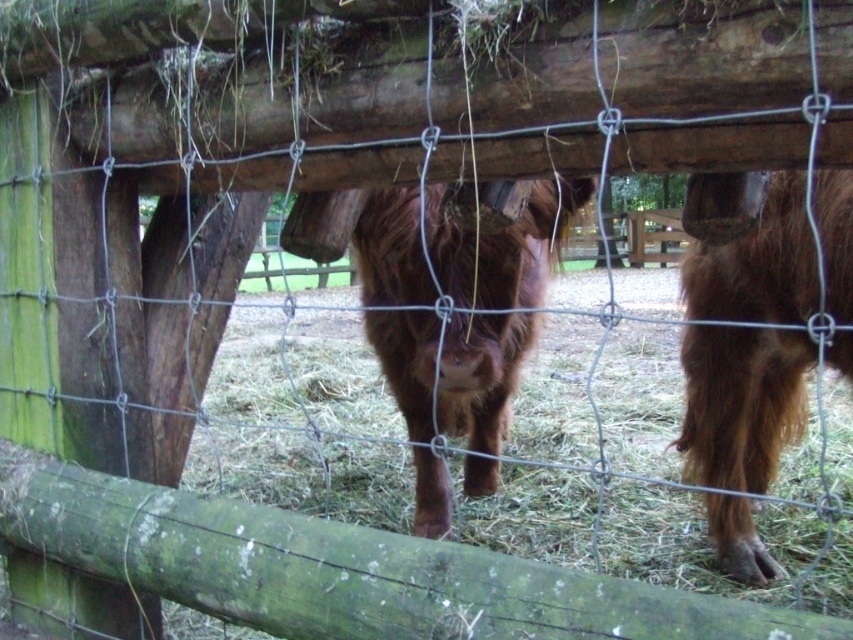
Can you confirm if brown fuzzy cow at right is shorter than brown fuzzy cow at center?

No, brown fuzzy cow at right is not shorter than brown fuzzy cow at center.

Is brown fuzzy cow at right taller than brown fuzzy cow at center?

Yes, brown fuzzy cow at right is taller than brown fuzzy cow at center.

You are a GUI agent. You are given a task and a screenshot of the screen. Output one action in this format:
    pyautogui.click(x=<x>, y=<y>)
    Task: Click on the brown fuzzy cow at right
    
    Given the screenshot: What is the action you would take?
    pyautogui.click(x=741, y=403)